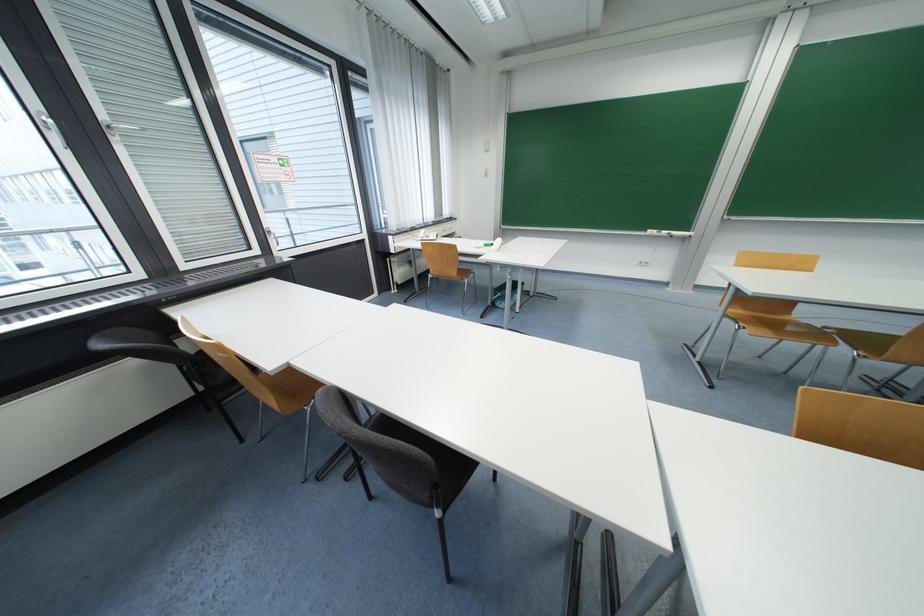
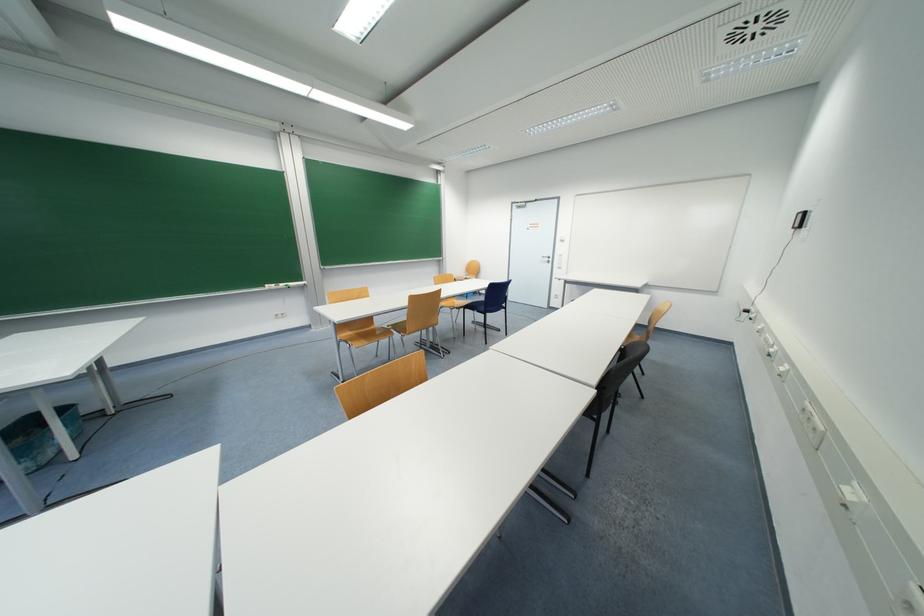
Where in the second image is the point corresponding to pixel 670 233 from the first image?

(286, 286)